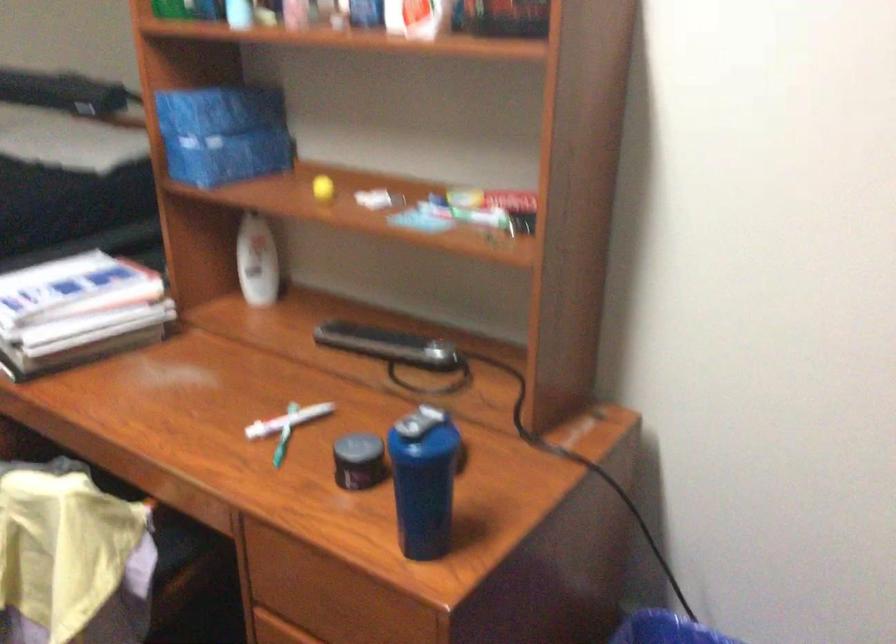
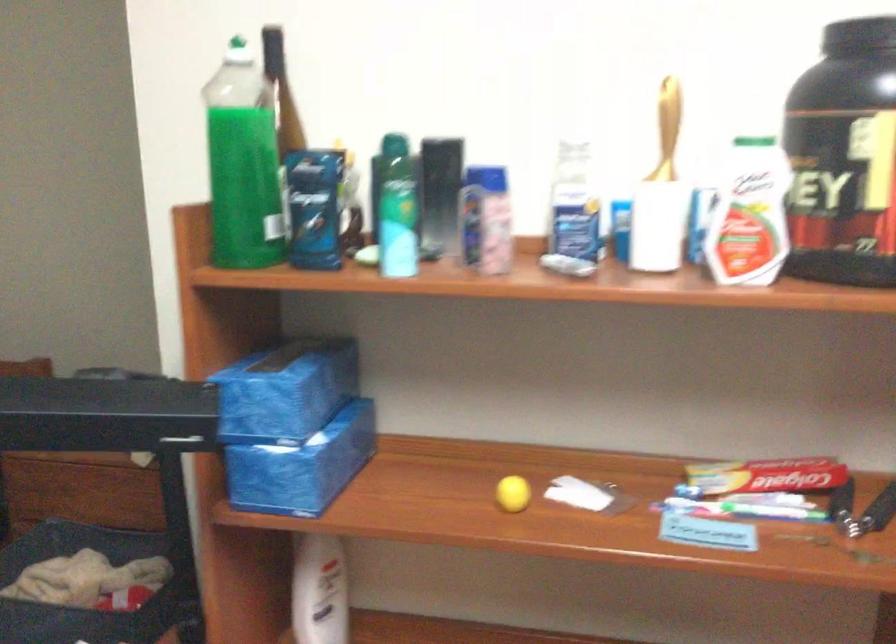
In the second image, find the point that corresponds to pixel 466 216 in the first image.

(743, 509)